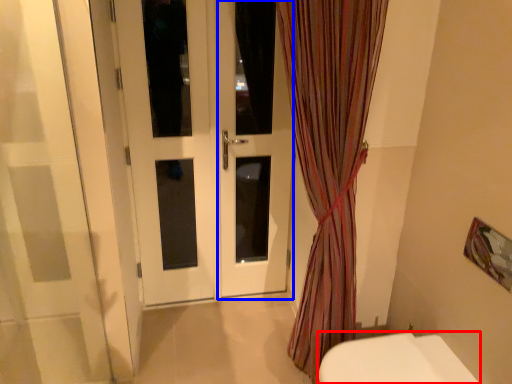
Question: Which object is further to the camera taking this photo, toilet (highlighted by a red box) or screen door (highlighted by a blue box)?

Choices:
 (A) toilet
 (B) screen door

Answer: (B)